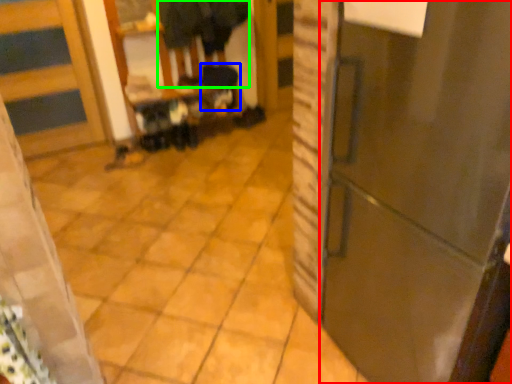
Question: Which is farther away from door (highlighted by a red box)? step stool (highlighted by a blue box) or couple (highlighted by a green box)?

Choices:
 (A) step stool
 (B) couple

Answer: (A)